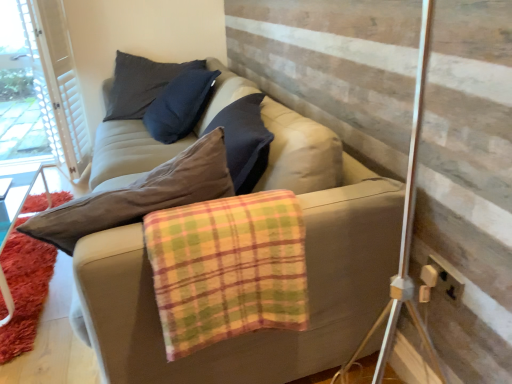
Question: From a real-world perspective, is white textured barn door at upper left under beige plastic socket at lower right?

Choices:
 (A) yes
 (B) no

Answer: (B)

Question: Are white textured barn door at upper left and beige plastic socket at lower right beside each other?

Choices:
 (A) no
 (B) yes

Answer: (A)

Question: Can we say white textured barn door at upper left lies outside beige plastic socket at lower right?

Choices:
 (A) no
 (B) yes

Answer: (B)

Question: Can you confirm if white textured barn door at upper left is positioned to the right of beige plastic socket at lower right?

Choices:
 (A) no
 (B) yes

Answer: (A)

Question: Is white textured barn door at upper left smaller than beige plastic socket at lower right?

Choices:
 (A) yes
 (B) no

Answer: (B)

Question: Considering the positions of shaggy orange rug at lower left and beige fabric couch at center in the image, is shaggy orange rug at lower left taller or shorter than beige fabric couch at center?

Choices:
 (A) short
 (B) tall

Answer: (A)

Question: Is shaggy orange rug at lower left wider or thinner than beige fabric couch at center?

Choices:
 (A) thin
 (B) wide

Answer: (A)

Question: From a real-world perspective, is shaggy orange rug at lower left above or below beige fabric couch at center?

Choices:
 (A) above
 (B) below

Answer: (B)

Question: Considering their positions, is shaggy orange rug at lower left located in front of or behind beige fabric couch at center?

Choices:
 (A) front
 (B) behind

Answer: (B)

Question: From a real-world perspective, is plaid flannel blanket at center above or below shaggy orange rug at lower left?

Choices:
 (A) above
 (B) below

Answer: (A)

Question: Considering the relative positions of plaid flannel blanket at center and shaggy orange rug at lower left in the image provided, is plaid flannel blanket at center to the left or to the right of shaggy orange rug at lower left?

Choices:
 (A) left
 (B) right

Answer: (B)

Question: In terms of width, does plaid flannel blanket at center look wider or thinner when compared to shaggy orange rug at lower left?

Choices:
 (A) thin
 (B) wide

Answer: (A)

Question: Which is correct: plaid flannel blanket at center is inside shaggy orange rug at lower left, or outside of it?

Choices:
 (A) outside
 (B) inside

Answer: (A)

Question: From a real-world perspective, is beige plastic socket at lower right physically located above or below beige fabric couch at center?

Choices:
 (A) above
 (B) below

Answer: (B)

Question: In terms of height, does beige plastic socket at lower right look taller or shorter compared to beige fabric couch at center?

Choices:
 (A) short
 (B) tall

Answer: (A)